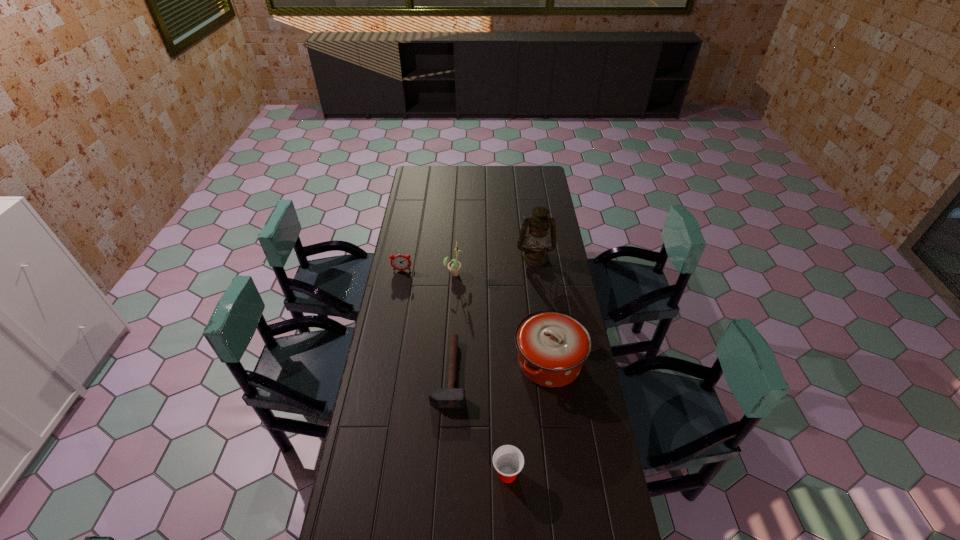
Identify the location of vacant area between the sunflower and the farthest object. (494, 265).

You are a GUI agent. You are given a task and a screenshot of the screen. Output one action in this format:
    pyautogui.click(x=<x>, y=<y>)
    Task: Click on the vacant space that's between the sunflower and the casserole
    The image size is (960, 540).
    Given the screenshot: What is the action you would take?
    pyautogui.click(x=502, y=318)

Where is `vacant area that lies between the casserole and the leftmost object`? Image resolution: width=960 pixels, height=540 pixels. vacant area that lies between the casserole and the leftmost object is located at coordinates (475, 316).

The image size is (960, 540). In order to click on the fourth closest object to the hammer in this screenshot , I will do `click(399, 262)`.

Identify the location of object identified as the fifth closest to the tallest object. (508, 460).

You are a GUI agent. You are given a task and a screenshot of the screen. Output one action in this format:
    pyautogui.click(x=<x>, y=<y>)
    Task: Click on the free space that satisfies the following two spatial constraints: 1. on the front-facing side of the casserole; 2. on the left side of the sunflower
    
    Given the screenshot: What is the action you would take?
    pyautogui.click(x=449, y=362)

I want to click on vacant space that satisfies the following two spatial constraints: 1. on the striking surface of the nearest object; 2. on the left side of the hammer, so click(x=444, y=474).

You are a GUI agent. You are given a task and a screenshot of the screen. Output one action in this format:
    pyautogui.click(x=<x>, y=<y>)
    Task: Click on the vacant space that satisfies the following two spatial constraints: 1. on the front-facing side of the leftmost object; 2. on the right side of the casserole
    The height and width of the screenshot is (540, 960).
    Given the screenshot: What is the action you would take?
    pos(385,362)